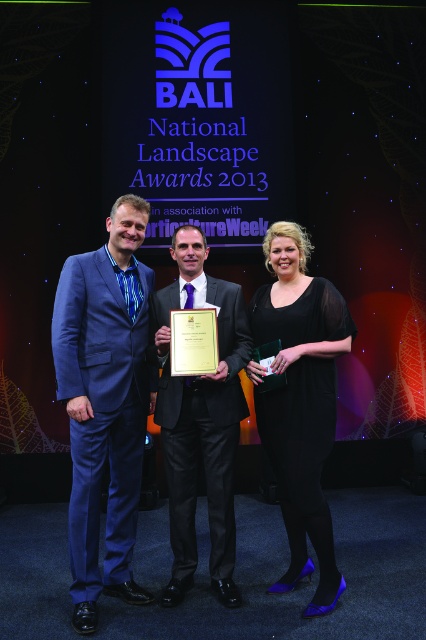
Question: Is black satin dress at center below shiny black suit at center?

Choices:
 (A) no
 (B) yes

Answer: (A)

Question: Which point is farther from the camera taking this photo?

Choices:
 (A) (322, 342)
 (B) (189, 408)
 (C) (108, 397)

Answer: (B)

Question: Can you confirm if black satin dress at center is positioned to the left of shiny black suit at center?

Choices:
 (A) no
 (B) yes

Answer: (A)

Question: Observing the image, what is the correct spatial positioning of blue velvet suit at left in reference to black satin dress at center?

Choices:
 (A) left
 (B) right

Answer: (A)

Question: Among these objects, which one is farthest from the camera?

Choices:
 (A) black satin dress at center
 (B) blue velvet suit at left

Answer: (A)

Question: Which of the following is the closest to the observer?

Choices:
 (A) (334, 392)
 (B) (72, 470)

Answer: (B)